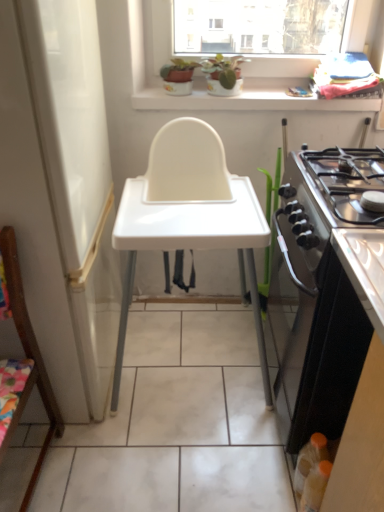
Where is `vacant space that is in between white plastic changing table at center and translucent plastic bottle at lower right`? The width and height of the screenshot is (384, 512). vacant space that is in between white plastic changing table at center and translucent plastic bottle at lower right is located at coordinates (215, 444).